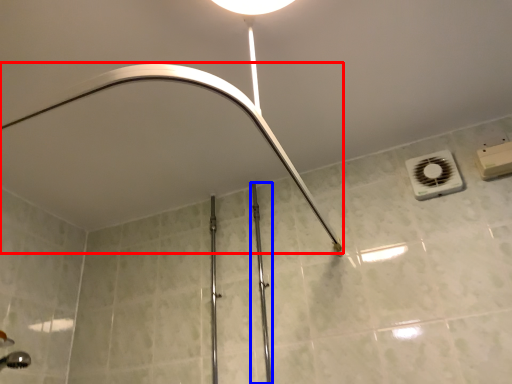
Question: Which object is further to the camera taking this photo, shower (highlighted by a red box) or rail (highlighted by a blue box)?

Choices:
 (A) shower
 (B) rail

Answer: (B)